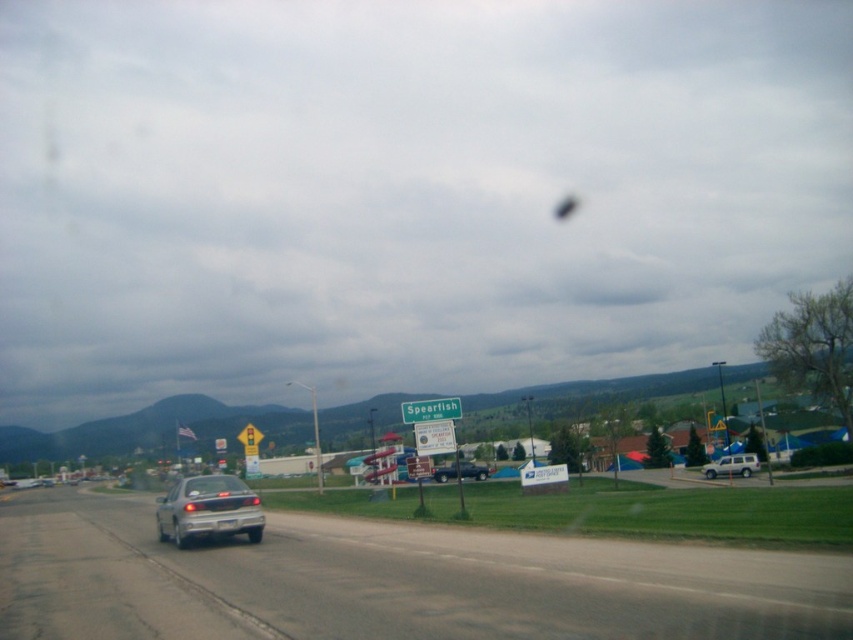
You are a pedestrian standing at the side of the road near the Spearfish town sign. You see a silver metallic car at lower left and a satin silver sedan at lower left. Which vehicle is closer to you?

The silver metallic car at lower left is closer to you because it is in front of the satin silver sedan at lower left.

You are standing at the intersection near the Spearfish road sign and want to take a photo of the white matte suv at right. Where should you position yourself to capture it in your camera frame?

To capture the white matte suv at right in your camera frame, position yourself at the intersection near the Spearfish road sign and aim your camera towards the right side of the scene, specifically at the coordinates point (732, 465) where the white matte suv at right is located.